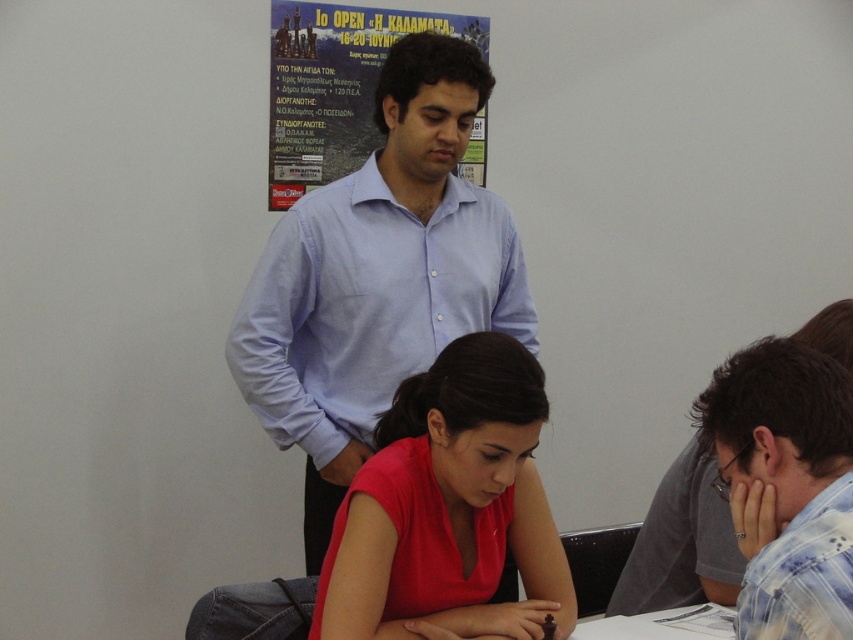
In the scene shown: Is matte red shirt at center to the right of blue plaid shirt at lower right from the viewer's perspective?

In fact, matte red shirt at center is to the left of blue plaid shirt at lower right.

Based on the photo, is matte red shirt at center taller than blue plaid shirt at lower right?

Yes, matte red shirt at center is taller than blue plaid shirt at lower right.

Locate an element on the screen. matte red shirt at center is located at coordinates (444, 497).

At what (x,y) coordinates should I click in order to perform the action: click on matte red shirt at center. Please return your answer as a coordinate pair (x, y). Looking at the image, I should click on (444, 497).

Between blue plaid shirt at lower right and matte paper poster at upper center, which one is positioned lower?

Positioned lower is blue plaid shirt at lower right.

Which of these two, blue plaid shirt at lower right or matte paper poster at upper center, stands shorter?

blue plaid shirt at lower right is shorter.

This screenshot has width=853, height=640. Describe the element at coordinates (788, 483) in the screenshot. I see `blue plaid shirt at lower right` at that location.

Where is `blue plaid shirt at lower right`? The width and height of the screenshot is (853, 640). blue plaid shirt at lower right is located at coordinates (788, 483).

Is point (283, 436) closer to viewer compared to point (799, 388)?

No, (283, 436) is behind (799, 388).

Does point (392, 148) come farther from viewer compared to point (726, 385)?

Yes, it is.

At what (x,y) coordinates should I click in order to perform the action: click on light blue shirt at upper center. Please return your answer as a coordinate pair (x, y). Looking at the image, I should click on (378, 276).